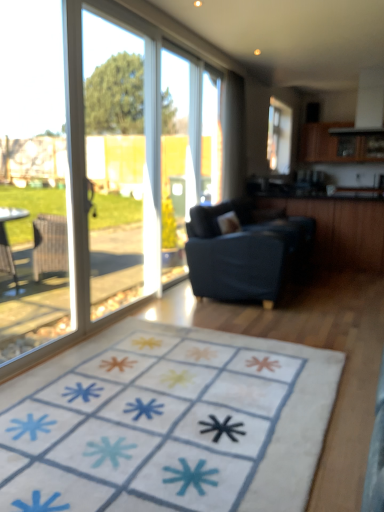
Where is `vacant area that is in front of dark blue fabric couch at center`? This screenshot has width=384, height=512. vacant area that is in front of dark blue fabric couch at center is located at coordinates (259, 326).